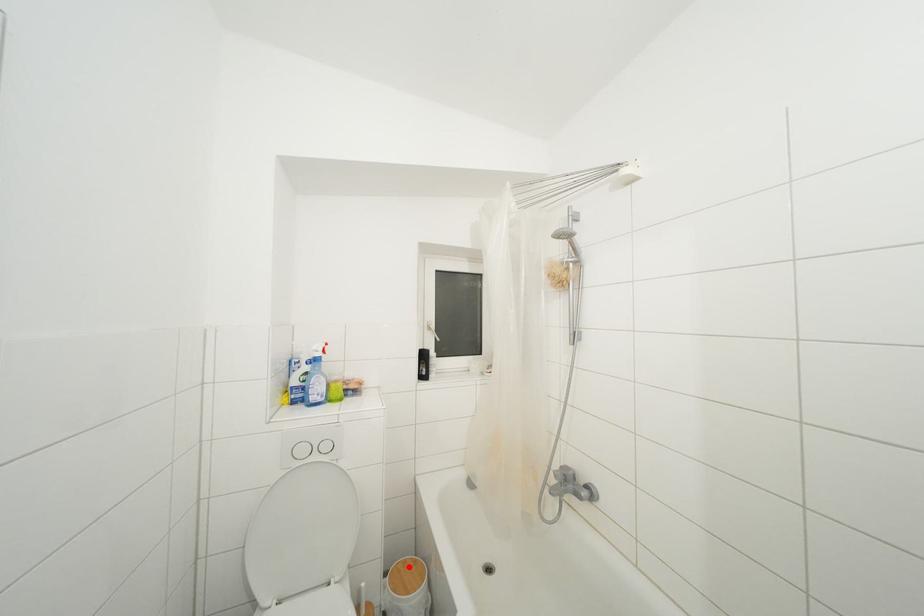
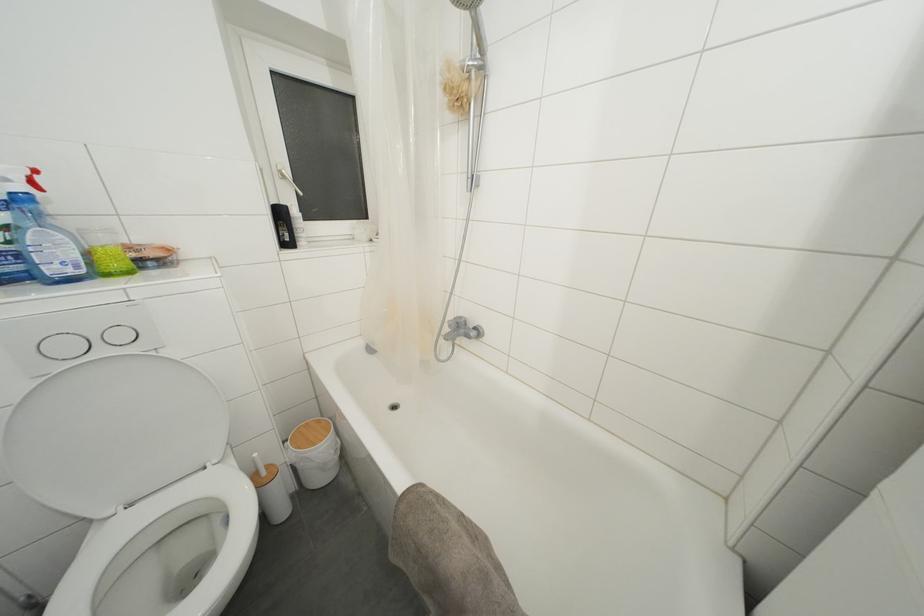
Question: I am providing you with two images of the same scene from different viewpoints. A red point is shown in image1. For the corresponding object point in image2, is it positioned nearer or farther from the camera?

Choices:
 (A) Nearer
 (B) Farther

Answer: (B)